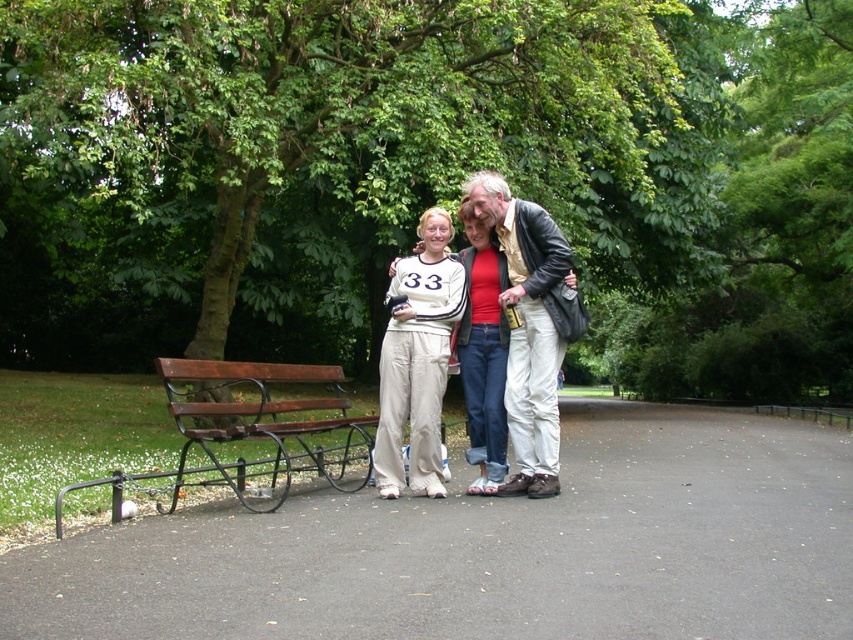
Question: Is smooth asphalt path at center bigger than brown wooden bench at left?

Choices:
 (A) no
 (B) yes

Answer: (B)

Question: Which point is farther to the camera?

Choices:
 (A) (239, 381)
 (B) (572, 284)
 (C) (758, 632)
 (D) (434, 401)

Answer: (A)

Question: Is smooth asphalt path at center smaller than matte black leather jacket at center?

Choices:
 (A) no
 (B) yes

Answer: (A)

Question: Which point is closer to the camera?

Choices:
 (A) matte black leather jacket at center
 (B) smooth asphalt path at center

Answer: (B)

Question: Is smooth asphalt path at center positioned at the back of white cotton pants at center?

Choices:
 (A) no
 (B) yes

Answer: (A)

Question: Which object appears closest to the camera in this image?

Choices:
 (A) smooth asphalt path at center
 (B) matte black leather jacket at center
 (C) brown wooden bench at left
 (D) white cotton pants at center

Answer: (A)